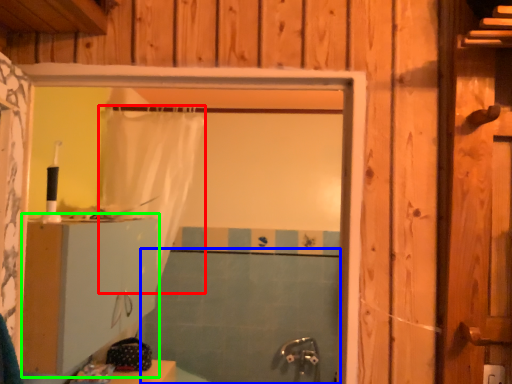
Question: Based on their relative distances, which object is nearer to shower curtain (highlighted by a red box)? Choose from bath (highlighted by a blue box) and dresser (highlighted by a green box).

Choices:
 (A) bath
 (B) dresser

Answer: (B)